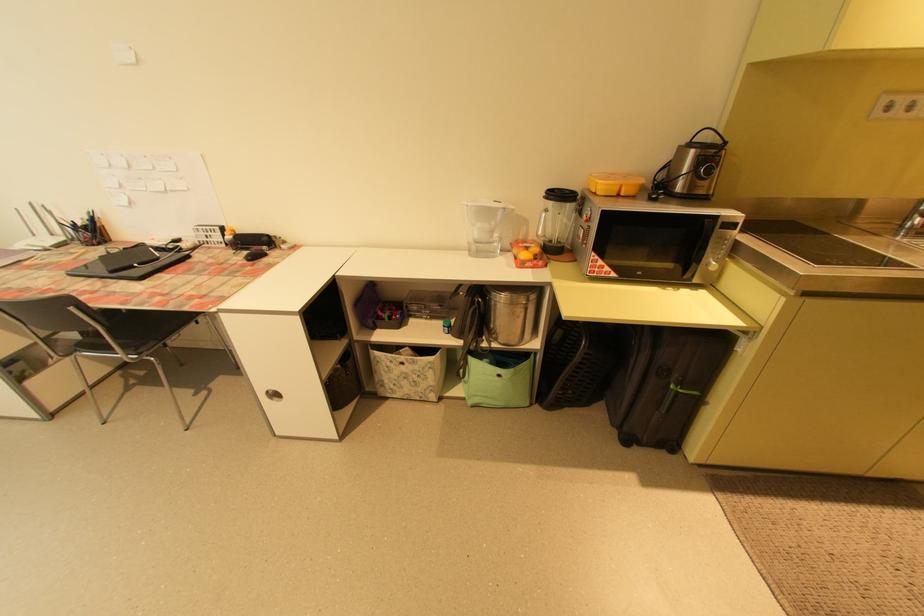
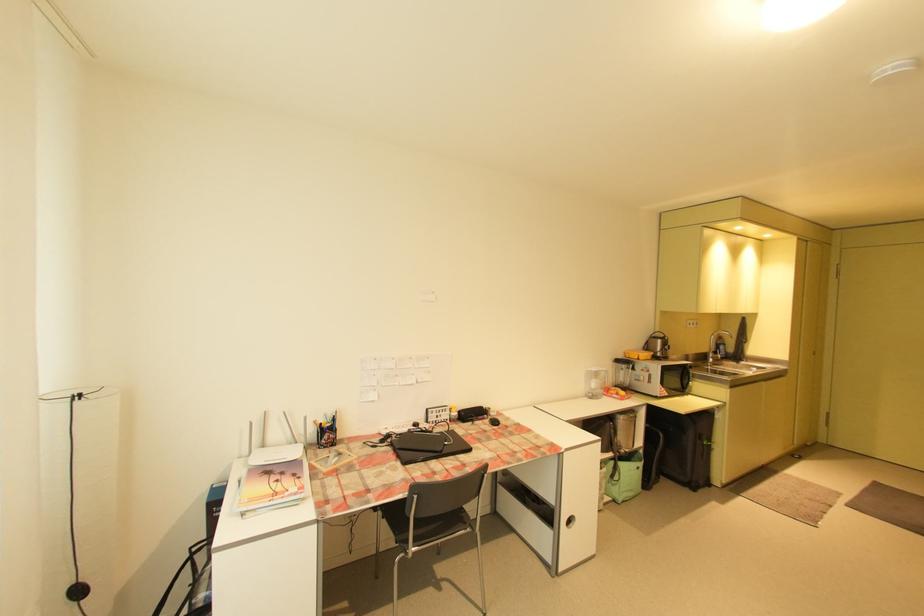
Where in the second image is the point corresponding to point 492,398 from the first image?

(634, 492)